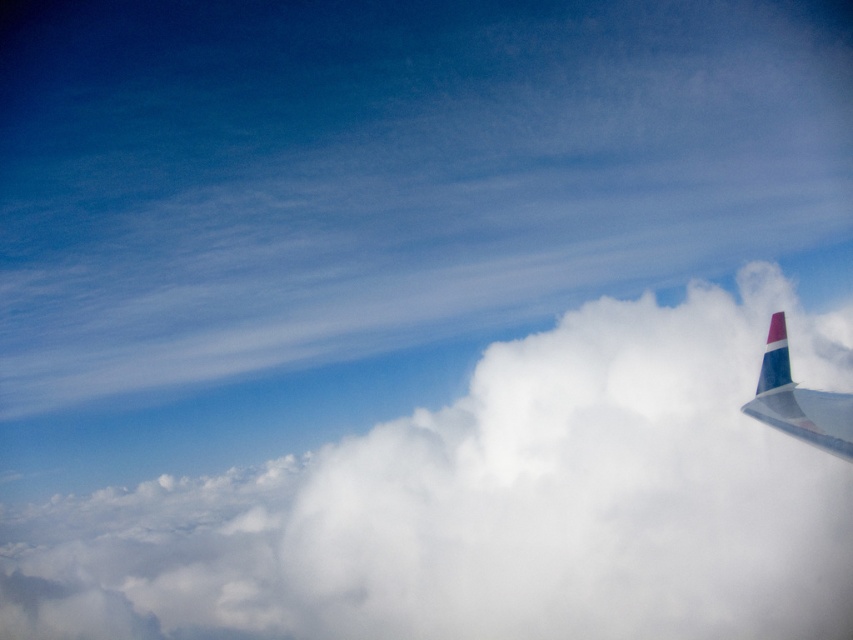
Is white fluffy cloud at upper right further to camera compared to polished aluminum winglet at upper right?

No, white fluffy cloud at upper right is closer to the viewer.

Between white fluffy cloud at upper right and polished aluminum winglet at upper right, which one has less height?

Standing shorter between the two is polished aluminum winglet at upper right.

Is point (254, 532) positioned in front of point (821, 419)?

That is False.

Where is `white fluffy cloud at upper right`? The image size is (853, 640). white fluffy cloud at upper right is located at coordinates [x=494, y=506].